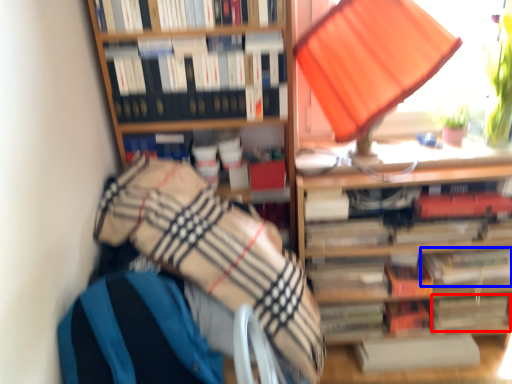
Question: Which point is closer to the camera, paperback book (highlighted by a red box) or book (highlighted by a blue box)?

Choices:
 (A) paperback book
 (B) book

Answer: (B)